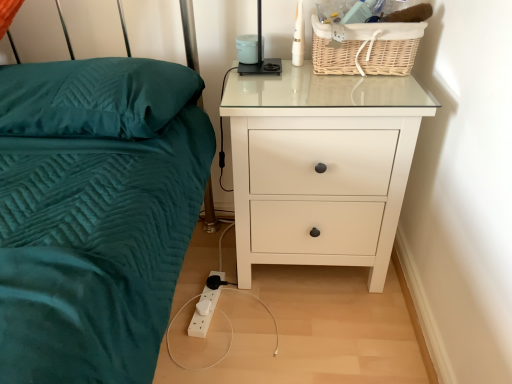
Question: Is the position of white glossy chest of drawers at right more distant than that of black plastic lamp at upper center?

Choices:
 (A) yes
 (B) no

Answer: (B)

Question: Could black plastic lamp at upper center be considered to be inside white glossy chest of drawers at right?

Choices:
 (A) no
 (B) yes

Answer: (A)

Question: From the image's perspective, is white glossy chest of drawers at right under black plastic lamp at upper center?

Choices:
 (A) no
 (B) yes

Answer: (B)

Question: From a real-world perspective, is white glossy chest of drawers at right physically above black plastic lamp at upper center?

Choices:
 (A) no
 (B) yes

Answer: (A)

Question: Does white glossy chest of drawers at right have a lesser height compared to black plastic lamp at upper center?

Choices:
 (A) no
 (B) yes

Answer: (A)

Question: In the image, is teal quilted pillow at left positioned in front of or behind white glossy chest of drawers at right?

Choices:
 (A) behind
 (B) front

Answer: (B)

Question: Based on their positions, is teal quilted pillow at left located to the left or right of white glossy chest of drawers at right?

Choices:
 (A) left
 (B) right

Answer: (A)

Question: From the image's perspective, is teal quilted pillow at left above or below white glossy chest of drawers at right?

Choices:
 (A) above
 (B) below

Answer: (A)

Question: Would you say teal quilted pillow at left is inside or outside white glossy chest of drawers at right?

Choices:
 (A) outside
 (B) inside

Answer: (A)

Question: Which is correct: black plastic lamp at upper center is inside white glossy chest of drawers at right, or outside of it?

Choices:
 (A) outside
 (B) inside

Answer: (A)

Question: Looking at the image, does black plastic lamp at upper center seem bigger or smaller compared to white glossy chest of drawers at right?

Choices:
 (A) small
 (B) big

Answer: (A)

Question: From their relative heights in the image, would you say black plastic lamp at upper center is taller or shorter than white glossy chest of drawers at right?

Choices:
 (A) tall
 (B) short

Answer: (B)

Question: From the image's perspective, is black plastic lamp at upper center located above or below white glossy chest of drawers at right?

Choices:
 (A) below
 (B) above

Answer: (B)

Question: From a real-world perspective, is woven natural basket at upper right above or below white glossy chest of drawers at right?

Choices:
 (A) below
 (B) above

Answer: (B)

Question: From the image's perspective, relative to white glossy chest of drawers at right, is woven natural basket at upper right above or below?

Choices:
 (A) above
 (B) below

Answer: (A)